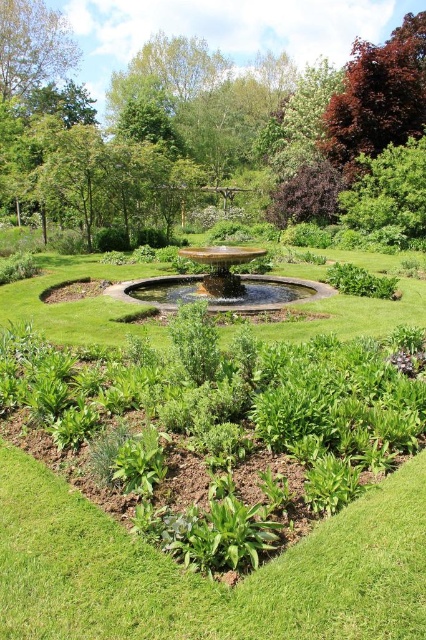
Which is above, purple-leaved tree at upper right or gold polished water at center?

Positioned higher is purple-leaved tree at upper right.

Is point (400, 115) positioned after point (305, 298)?

Yes, point (400, 115) is behind point (305, 298).

Is point (365, 58) in front of point (241, 288)?

No, it is not.

The width and height of the screenshot is (426, 640). Find the location of `purple-leaved tree at upper right`. purple-leaved tree at upper right is located at coordinates (377, 97).

Is purple-leaved tree at upper right positioned in front of gold metallic fountain at center?

No, it is not.

Between purple-leaved tree at upper right and gold metallic fountain at center, which one is positioned lower?

gold metallic fountain at center is below.

At what (x,y) coordinates should I click in order to perform the action: click on purple-leaved tree at upper right. Please return your answer as a coordinate pair (x, y). This screenshot has height=640, width=426. Looking at the image, I should click on (377, 97).

Locate an element on the screen. purple-leaved tree at upper right is located at coordinates (377, 97).

Does purple leafy tree at upper center lie in front of green leafy tree at upper left?

That is True.

Can you confirm if purple leafy tree at upper center is positioned to the left of green leafy tree at upper left?

No, purple leafy tree at upper center is not to the left of green leafy tree at upper left.

Is point (149, 196) positioned after point (32, 10)?

No, it is not.

You are a GUI agent. You are given a task and a screenshot of the screen. Output one action in this format:
    pyautogui.click(x=<x>, y=<y>)
    Task: Click on the purple leafy tree at upper center
    The height and width of the screenshot is (640, 426).
    Given the screenshot: What is the action you would take?
    pyautogui.click(x=192, y=128)